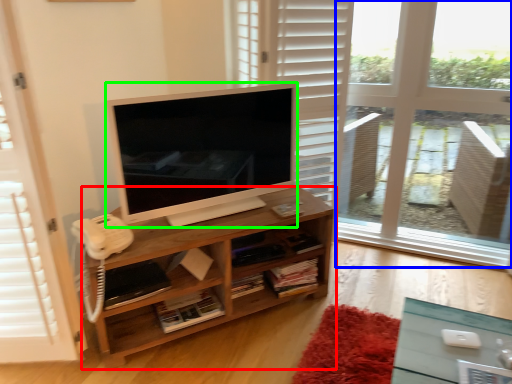
Question: Based on their relative distances, which object is farther from shelf (highlighted by a red box)? Choose from window frame (highlighted by a blue box) and television (highlighted by a green box).

Choices:
 (A) window frame
 (B) television

Answer: (A)